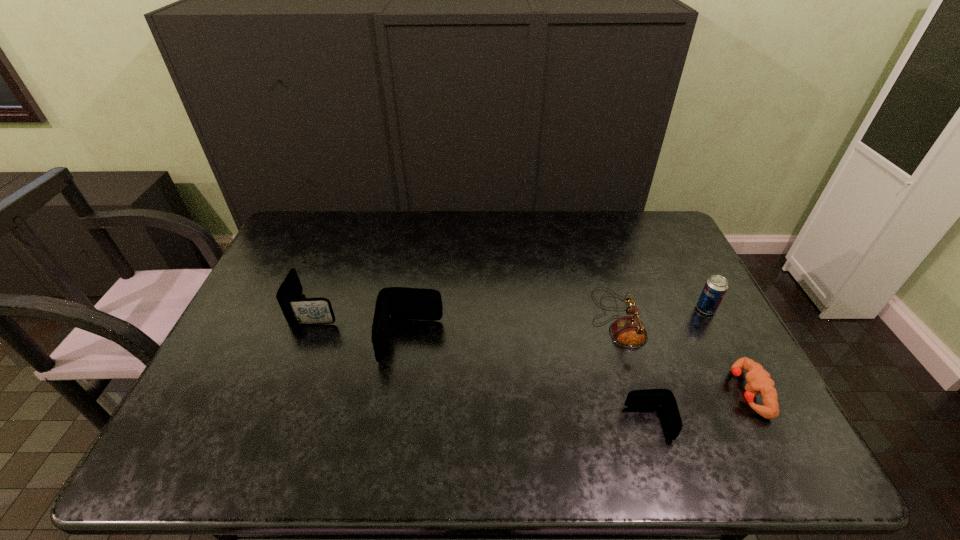
Where is `the leftmost object`? The width and height of the screenshot is (960, 540). the leftmost object is located at coordinates (297, 311).

Locate an element on the screen. The image size is (960, 540). the second tallest wallet is located at coordinates [x=297, y=311].

Where is `the second wallet from left to right`? the second wallet from left to right is located at coordinates (393, 303).

Where is `the rightmost wallet`? This screenshot has width=960, height=540. the rightmost wallet is located at coordinates (648, 398).

Identify the location of the nearest wallet. The image size is (960, 540). (648, 398).

Locate an element on the screen. This screenshot has height=540, width=960. beer can is located at coordinates (716, 286).

Image resolution: width=960 pixels, height=540 pixels. I want to click on telephone, so click(x=628, y=331).

You are a GUI agent. You are given a task and a screenshot of the screen. Output one action in this format:
    pyautogui.click(x=<x>, y=<y>)
    Task: Click on the puncher
    This screenshot has width=960, height=540.
    Given the screenshot: What is the action you would take?
    pyautogui.click(x=759, y=380)

Where is `free region located on the outer surface of the second tallest wallet`? This screenshot has height=540, width=960. free region located on the outer surface of the second tallest wallet is located at coordinates (390, 308).

What are the coordinates of `free spot located on the outer surface of the second wallet from right to left` in the screenshot? It's located at (400, 408).